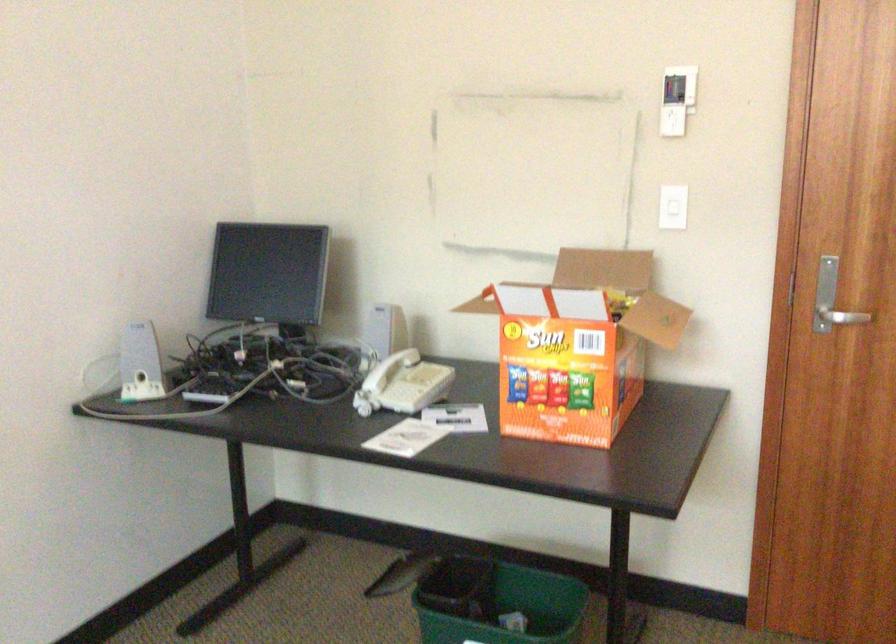
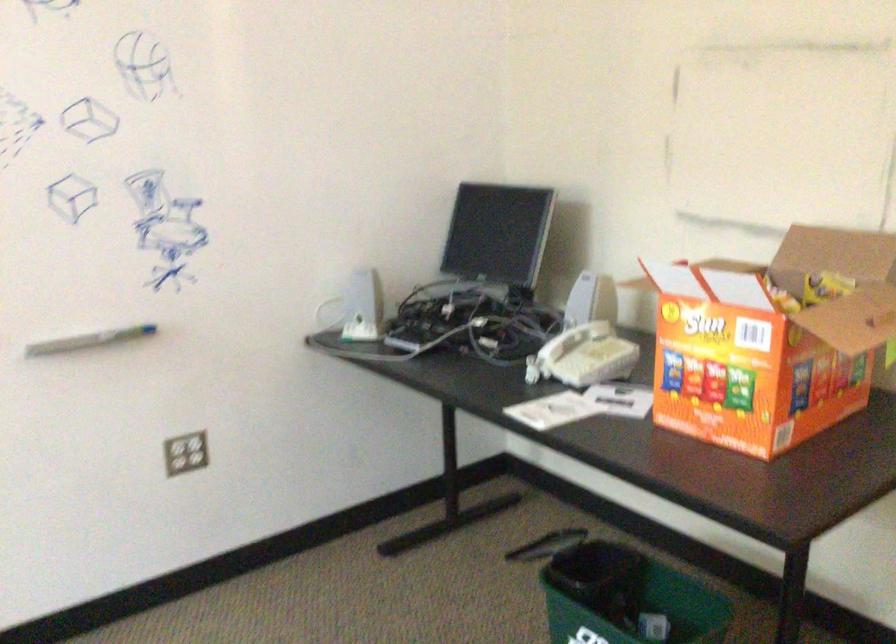
Where in the second image is the point corresponding to point (384, 336) from the first image?

(579, 305)